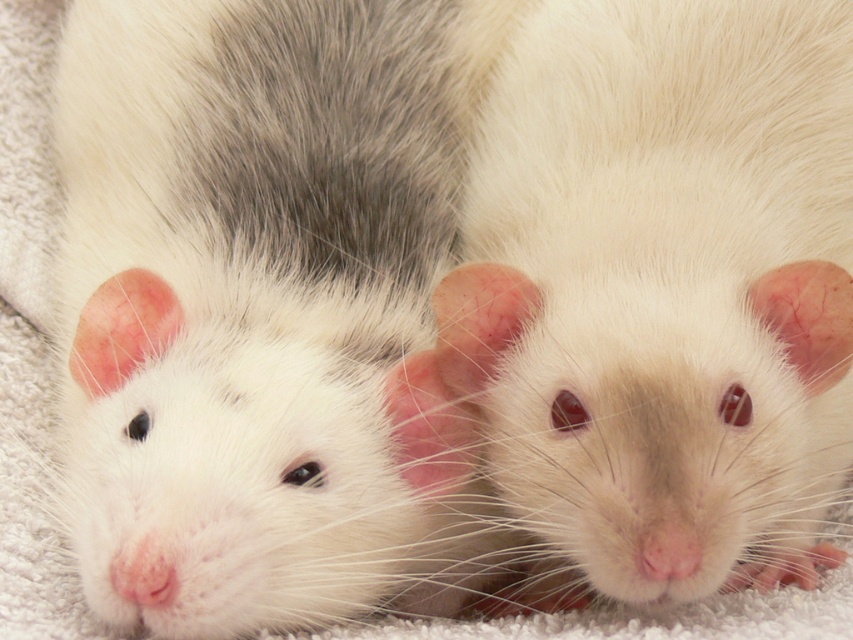
Question: Can you confirm if white soft fur hamster at center is wider than white fur hamster at center?

Choices:
 (A) yes
 (B) no

Answer: (A)

Question: Does white soft fur hamster at center have a lesser width compared to white fur hamster at center?

Choices:
 (A) yes
 (B) no

Answer: (B)

Question: Can you confirm if white soft fur hamster at center is positioned to the right of white fur hamster at center?

Choices:
 (A) no
 (B) yes

Answer: (A)

Question: Which point is farther to the camera?

Choices:
 (A) white fur hamster at center
 (B) white soft fur hamster at center

Answer: (A)

Question: Which point is farther to the camera?

Choices:
 (A) (268, 454)
 (B) (827, 51)

Answer: (B)